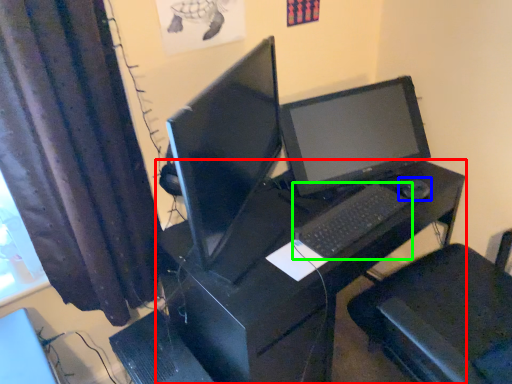
Question: Which object is the closest to the desk (highlighted by a red box)? Choose among these: mouse (highlighted by a blue box) or computer keyboard (highlighted by a green box).

Choices:
 (A) mouse
 (B) computer keyboard

Answer: (B)